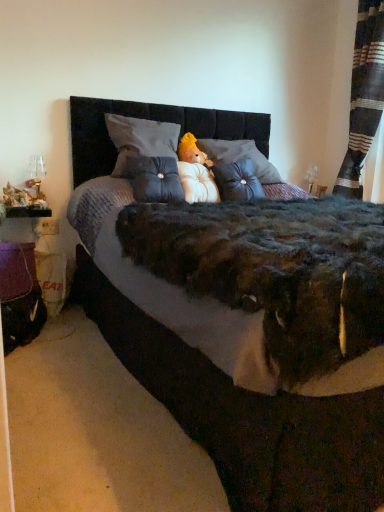
Question: Is white soft pillow at center facing towards velvet gray throw pillow at center, the 2th throw pillow viewed from the left?

Choices:
 (A) no
 (B) yes

Answer: (A)

Question: From the image's perspective, is white soft pillow at center below velvet gray throw pillow at center, the 2th throw pillow viewed from the left?

Choices:
 (A) yes
 (B) no

Answer: (B)

Question: Is white soft pillow at center located outside velvet gray throw pillow at center, the 2th throw pillow viewed from the left?

Choices:
 (A) no
 (B) yes

Answer: (B)

Question: Are white soft pillow at center and velvet gray throw pillow at center, the first throw pillow from the right, making contact?

Choices:
 (A) no
 (B) yes

Answer: (A)

Question: Does white soft pillow at center lie behind velvet gray throw pillow at center, the first throw pillow from the right?

Choices:
 (A) yes
 (B) no

Answer: (B)

Question: Would you say white soft pillow at center contains velvet gray throw pillow at center, the 2th throw pillow viewed from the left?

Choices:
 (A) no
 (B) yes

Answer: (A)

Question: Is striped fabric curtain at right closer to camera compared to white soft pillow at center?

Choices:
 (A) yes
 (B) no

Answer: (B)

Question: Does striped fabric curtain at right have a greater width compared to white soft pillow at center?

Choices:
 (A) yes
 (B) no

Answer: (A)

Question: Is striped fabric curtain at right far away from white soft pillow at center?

Choices:
 (A) yes
 (B) no

Answer: (A)

Question: From the image's perspective, is striped fabric curtain at right located above white soft pillow at center?

Choices:
 (A) yes
 (B) no

Answer: (A)

Question: Could you tell me if striped fabric curtain at right is turned towards white soft pillow at center?

Choices:
 (A) no
 (B) yes

Answer: (B)

Question: Considering the relative sizes of striped fabric curtain at right and white soft pillow at center in the image provided, is striped fabric curtain at right taller than white soft pillow at center?

Choices:
 (A) no
 (B) yes

Answer: (B)

Question: Is tufted fabric pillow at center, which appears as the first throw pillow when viewed from the left, closer to the viewer compared to velvet gray throw pillow at center, the 2th throw pillow viewed from the left?

Choices:
 (A) yes
 (B) no

Answer: (A)